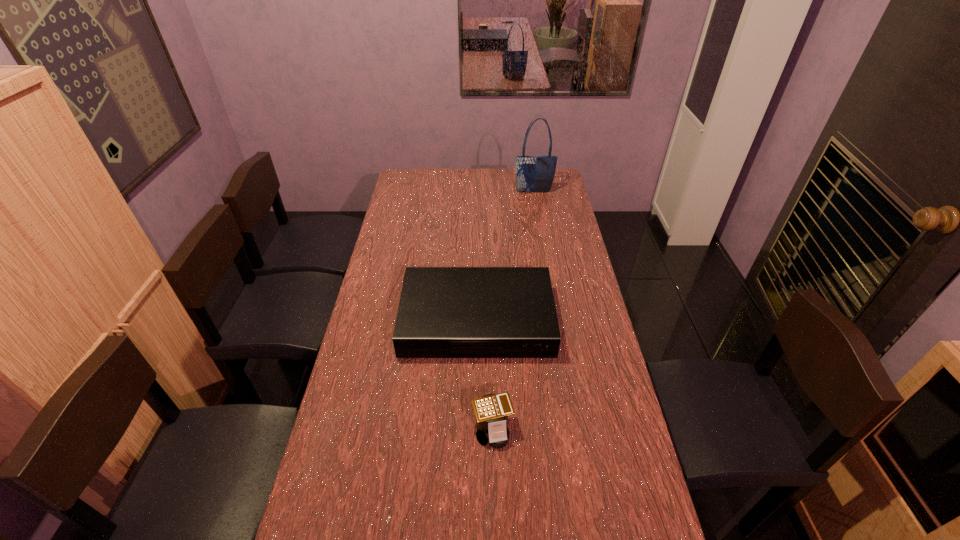
Where is `object situated at the far right corner`? object situated at the far right corner is located at coordinates (533, 173).

The height and width of the screenshot is (540, 960). In the image, there is a desktop. What are the coordinates of `vacant space at the far edge` in the screenshot? It's located at (492, 183).

Locate an element on the screen. free region at the left edge is located at coordinates (411, 206).

Identify the location of blank space at the right edge of the desktop. (575, 293).

At what (x,y) coordinates should I click in order to perform the action: click on free space between the farthest object and the CD player. Please return your answer as a coordinate pair (x, y). Looking at the image, I should click on (505, 256).

The image size is (960, 540). I want to click on vacant region between the nearest object and the CD player, so click(x=485, y=375).

The width and height of the screenshot is (960, 540). I want to click on vacant area between the nearest object and the second farthest object, so click(x=485, y=375).

Locate an element on the screen. The image size is (960, 540). free area in between the second farthest object and the nearest object is located at coordinates (485, 375).

This screenshot has width=960, height=540. Identify the location of free space between the farthest object and the second nearest object. (505, 256).

Identify the location of the second closest object to the CD player. This screenshot has width=960, height=540. click(x=533, y=173).